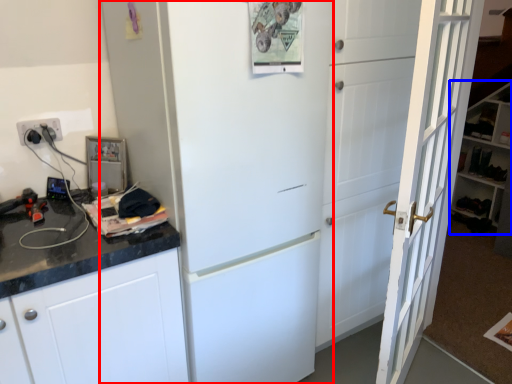
Question: Which point is closer to the camera, refrigerator (highlighted by a red box) or bookshelf (highlighted by a blue box)?

Choices:
 (A) refrigerator
 (B) bookshelf

Answer: (A)